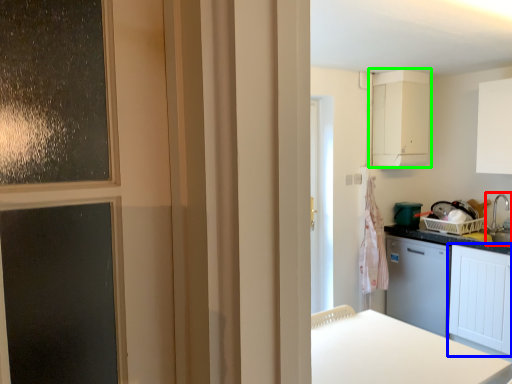
Question: Which object is positioned closest to sink (highlighted by a red box)? Select from cabinetry (highlighted by a blue box) and cabinetry (highlighted by a green box).

Choices:
 (A) cabinetry
 (B) cabinetry

Answer: (A)